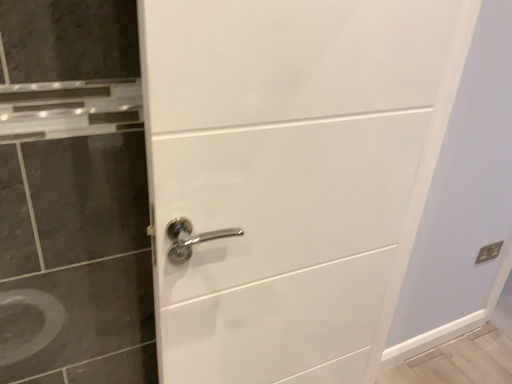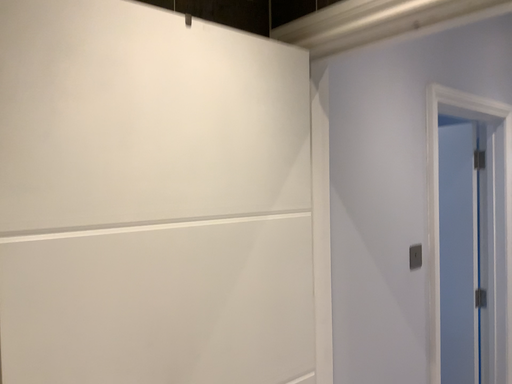
Question: Which way did the camera rotate in the video?

Choices:
 (A) rotated upward
 (B) rotated downward

Answer: (A)